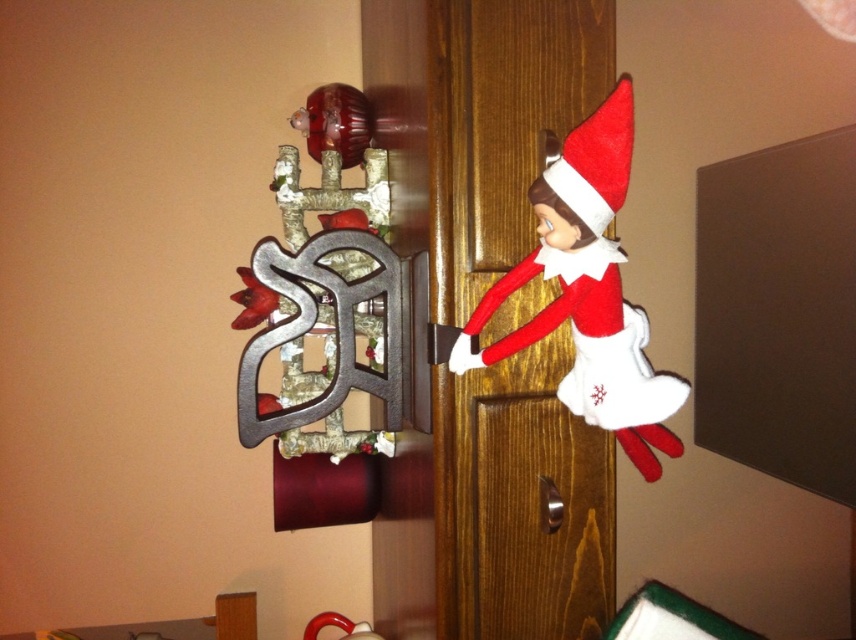
Measure the distance between point (551, 634) and camera.

They are 1.03 meters apart.

Between point (507, 248) and point (545, 518), which one is positioned behind?

The point (545, 518) is behind.

Locate an element on the screen. The image size is (856, 640). wooden door at center is located at coordinates (520, 502).